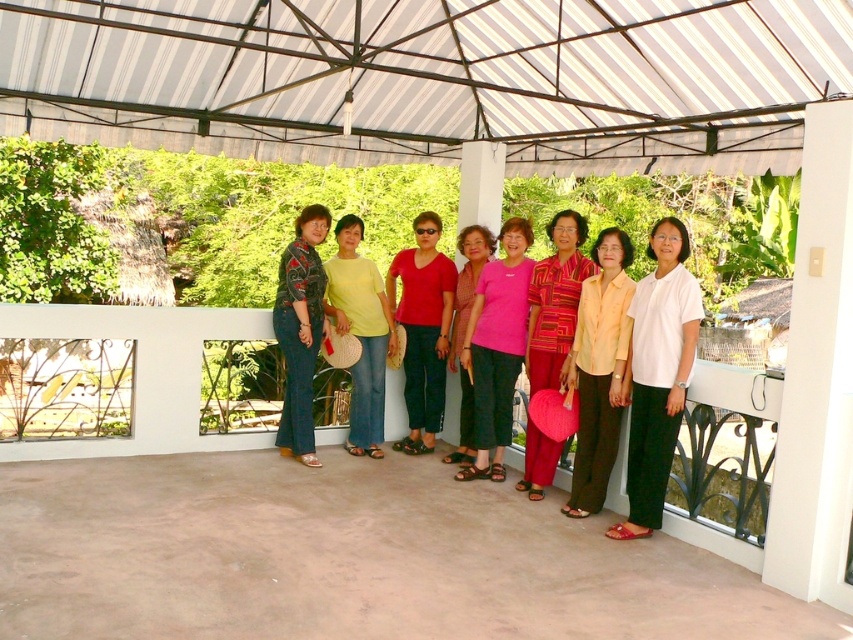
Question: Does pink fabric shirt at center lie in front of pink fabric dress at center?

Choices:
 (A) no
 (B) yes

Answer: (B)

Question: Which is farther from the textured pink fabric at center?

Choices:
 (A) pink fabric shirt at center
 (B) white matte blouse at center

Answer: (B)

Question: Which of the following is the farthest from the observer?

Choices:
 (A) (403, 300)
 (B) (610, 298)
 (C) (476, 346)
 (D) (532, 296)

Answer: (A)

Question: Does matte yellow blouse at center have a smaller size compared to textured pink fabric at center?

Choices:
 (A) no
 (B) yes

Answer: (B)

Question: Does pink fabric shirt at center lie in front of textured pink fabric at center?

Choices:
 (A) yes
 (B) no

Answer: (B)

Question: Estimate the real-world distances between objects in this image. Which object is farther from the pink fabric dress at center?

Choices:
 (A) matte yellow blouse at center
 (B) pink fabric shirt at center
 (C) matte red shirt at center

Answer: (A)